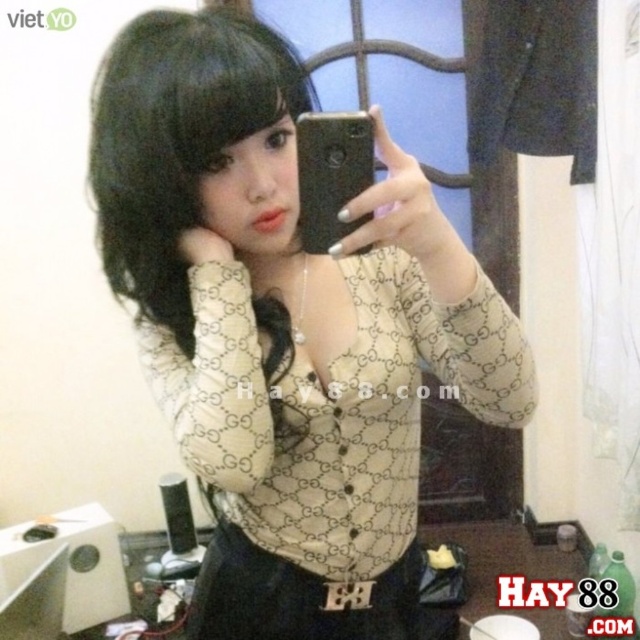
You are trying to take a photo of the beige printed shirt at center using the black matte smartphone at center. Based on their positions, will the smartphone be able to capture the entire shirt in the frame without moving?

The beige printed shirt at center is closer to the viewer than the black matte smartphone at center, so the smartphone will not be able to capture the entire shirt in the frame without moving closer or adjusting the angle.

You are trying to decide whether to wear the beige printed shirt at center with your favorite black silky hair at upper left. Based on the image, will the shirt cover the hair when worn?

The beige printed shirt at center might be wider than black silky hair at upper left, so there is a possibility that the shirt could cover the hair when worn depending on how it is styled.